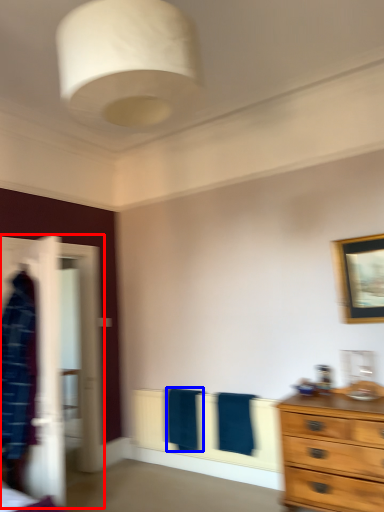
Question: Which object is further to the camera taking this photo, closet (highlighted by a red box) or bath towel (highlighted by a blue box)?

Choices:
 (A) closet
 (B) bath towel

Answer: (B)